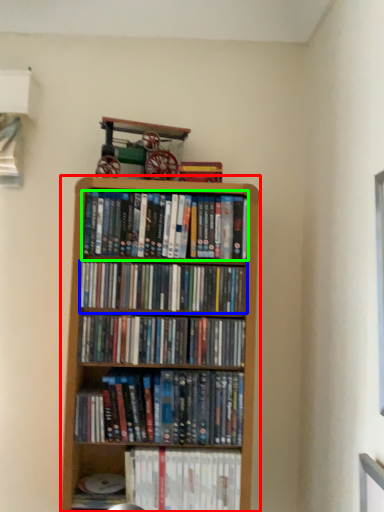
Question: Based on their relative distances, which object is farther from bookcase (highlighted by a red box)? Choose from book (highlighted by a blue box) and book (highlighted by a green box).

Choices:
 (A) book
 (B) book

Answer: (B)